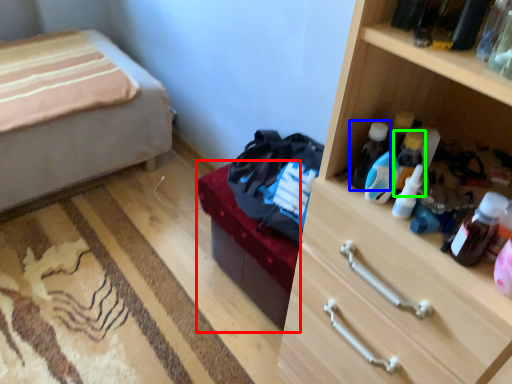
Question: Which object is positioned closest to bed frame (highlighted by a red box)? Select from bottle (highlighted by a blue box) and bottle (highlighted by a green box).

Choices:
 (A) bottle
 (B) bottle

Answer: (A)